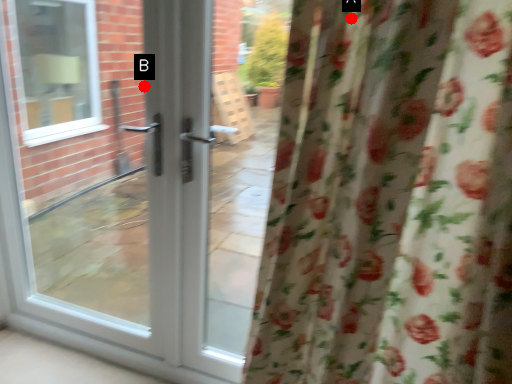
Question: Two points are circled on the image, labeled by A and B beside each circle. Which point appears closest to the camera in this image?

Choices:
 (A) A is closer
 (B) B is closer

Answer: (A)